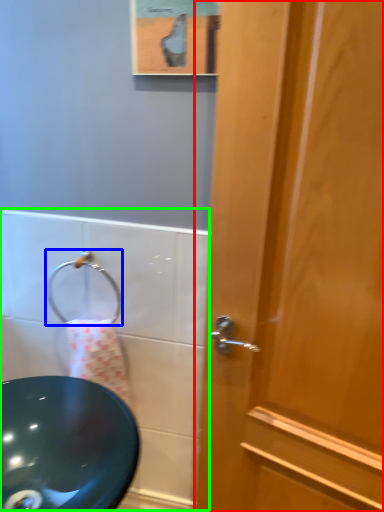
Question: Which object is the farthest from door (highlighted by a red box)? Choose among these: shower (highlighted by a blue box) or bath (highlighted by a green box).

Choices:
 (A) shower
 (B) bath

Answer: (A)